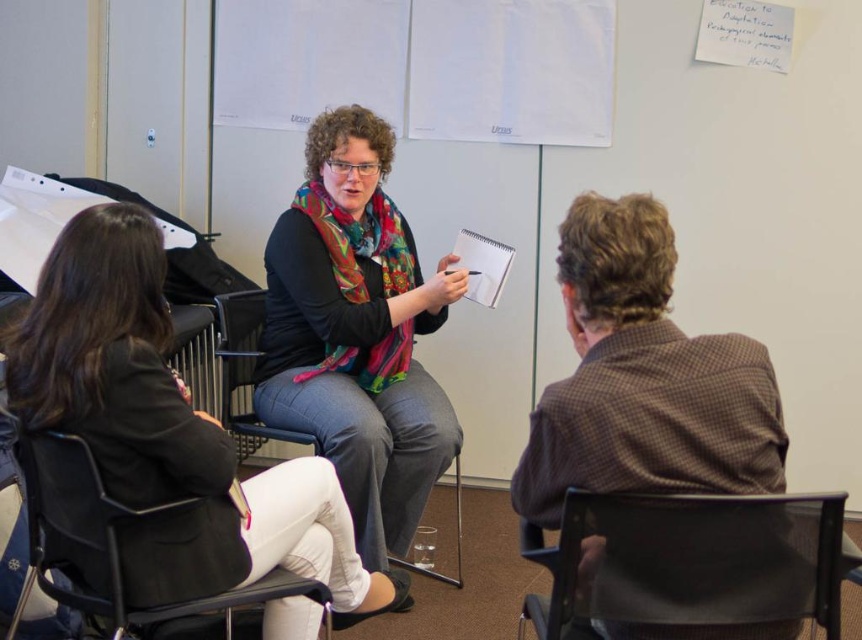
You are organizing a small event and need to know if the multicolored scarf at center can be placed on the black mesh chair at lower left without hanging over the edges. Based on their sizes, can it fit?

The multicolored scarf at center has a width less than the black mesh chair at lower left, so it can be placed on the black mesh chair at lower left without hanging over the edges.

You are a photographer standing in the room. You want to take a photo of the multicolored scarf at center and the black mesh chair at lower right so that both are clearly visible. Based on their sizes, which object should you focus on first to ensure proper focus?

The multicolored scarf at center has a greater height compared to the black mesh chair at lower right, so you should focus on the multicolored scarf at center first to ensure proper focus since it is larger and might require more precise focusing.